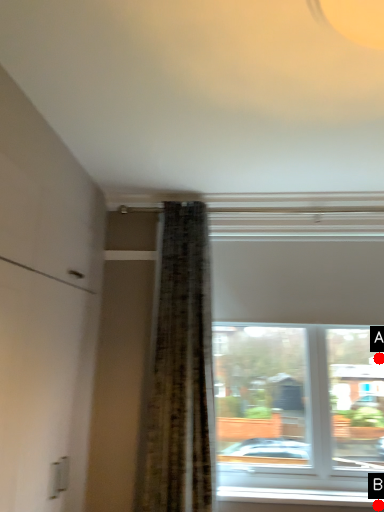
Question: Two points are circled on the image, labeled by A and B beside each circle. Which point is closer to the camera?

Choices:
 (A) A is closer
 (B) B is closer

Answer: (B)